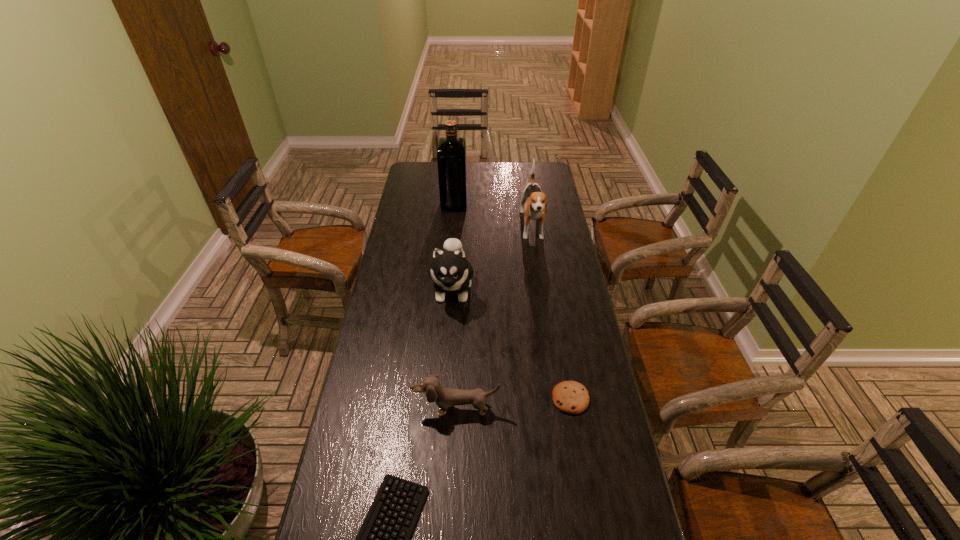
Image resolution: width=960 pixels, height=540 pixels. In order to click on free space that is in between the nearest puppy and the cookie in this screenshot , I will do `click(514, 403)`.

Identify the location of free spot between the shortest puppy and the second nearest puppy. (454, 348).

Find the location of `unoccupied area between the shortest puppy and the second nearest puppy`. unoccupied area between the shortest puppy and the second nearest puppy is located at coordinates point(454,348).

Find the location of a particular element. The height and width of the screenshot is (540, 960). free space between the farthest puppy and the liquor is located at coordinates (493, 216).

Locate which object ranks third in proximity to the liquor. Please provide its 2D coordinates. Your answer should be formatted as a tuple, i.e. [(x, y)], where the tuple contains the x and y coordinates of a point satisfying the conditions above.

[(571, 397)]

Locate an element on the screen. the second closest object relative to the farthest puppy is located at coordinates (451, 155).

At what (x,y) coordinates should I click in order to perform the action: click on puppy that is the second closest to the second nearest puppy. Please return your answer as a coordinate pair (x, y). The width and height of the screenshot is (960, 540). Looking at the image, I should click on (444, 397).

Select which puppy appears as the closest to the farthest puppy. Please provide its 2D coordinates. Your answer should be formatted as a tuple, i.e. [(x, y)], where the tuple contains the x and y coordinates of a point satisfying the conditions above.

[(450, 270)]

Where is `free space that satisfies the following two spatial constraints: 1. on the front label of the tallest object; 2. on the back side of the second shortest object`? The image size is (960, 540). free space that satisfies the following two spatial constraints: 1. on the front label of the tallest object; 2. on the back side of the second shortest object is located at coordinates (439, 399).

I want to click on vacant space that satisfies the following two spatial constraints: 1. on the front label of the liquor; 2. on the left side of the cookie, so click(x=439, y=399).